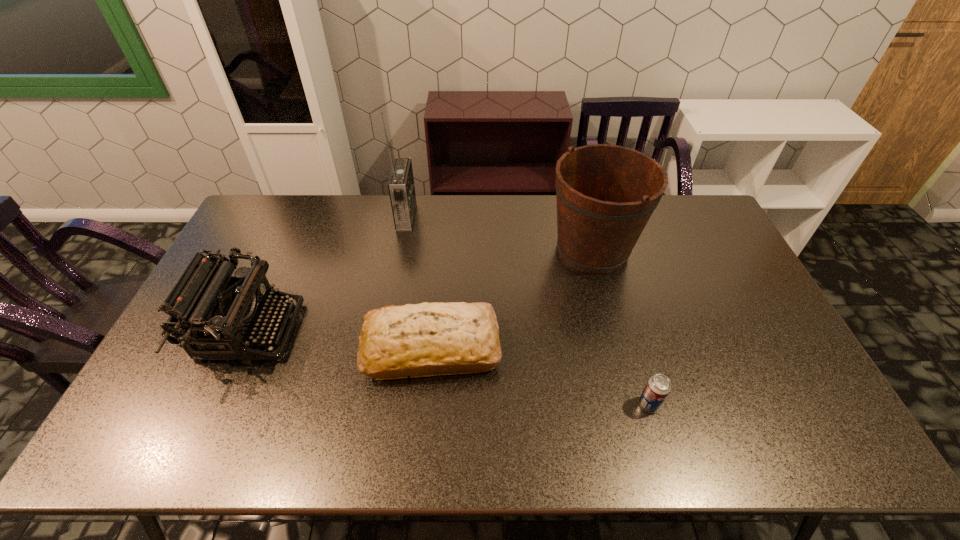
You are a GUI agent. You are given a task and a screenshot of the screen. Output one action in this format:
    pyautogui.click(x=<x>, y=<y>)
    Task: Click on the free point located 0.050m on the right of the second shortest object
    The height and width of the screenshot is (540, 960).
    Given the screenshot: What is the action you would take?
    pyautogui.click(x=518, y=348)

The image size is (960, 540). What are the coordinates of `vacant space located on the right of the beer can` in the screenshot? It's located at (811, 404).

Identify the location of radio receiver that is positioned at the far edge. Image resolution: width=960 pixels, height=540 pixels. (401, 187).

Image resolution: width=960 pixels, height=540 pixels. I want to click on bucket that is at the far edge, so click(605, 194).

Locate an element on the screen. This screenshot has height=540, width=960. object present at the left edge is located at coordinates (219, 316).

The image size is (960, 540). I want to click on vacant region at the far edge of the desktop, so click(522, 201).

This screenshot has width=960, height=540. Find the location of `vacant region at the near edge of the desktop`. vacant region at the near edge of the desktop is located at coordinates (x=597, y=443).

Find the location of a particular element. This screenshot has height=540, width=960. free space at the right edge is located at coordinates (734, 267).

Where is `free space at the far left corner of the desktop`? This screenshot has height=540, width=960. free space at the far left corner of the desktop is located at coordinates (262, 207).

The height and width of the screenshot is (540, 960). In order to click on vacant space at the far right corner in this screenshot , I will do [x=711, y=217].